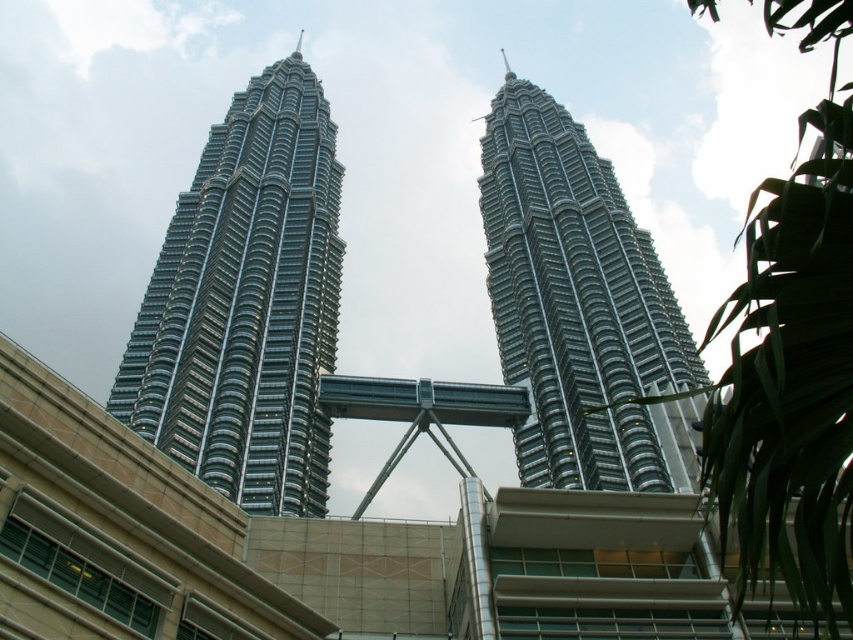
Is point (250, 316) less distant than point (500, 134)?

Yes, point (250, 316) is closer to viewer.

Between point (325, 108) and point (534, 115), which one is positioned behind?

Point (325, 108)

Locate an element on the screen. This screenshot has height=640, width=853. glassy steel skyscraper at center is located at coordinates (247, 304).